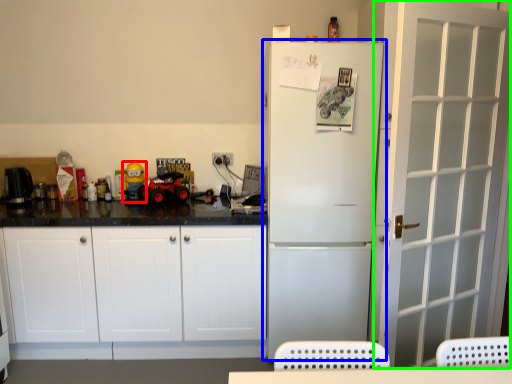
Question: Based on their relative distances, which object is farther from toy (highlighted by a red box)? Choose from refrigerator (highlighted by a blue box) and door (highlighted by a green box).

Choices:
 (A) refrigerator
 (B) door

Answer: (B)